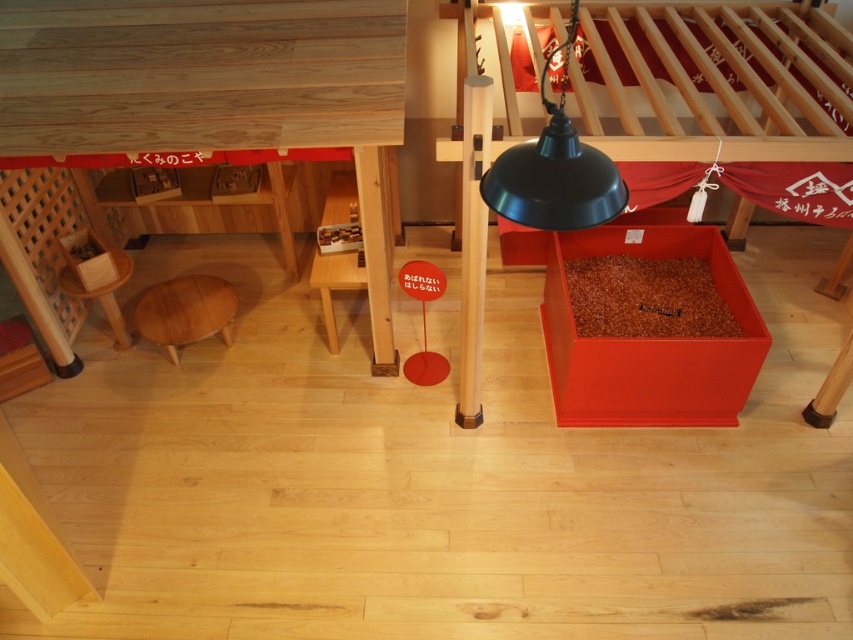
Between point (7, 81) and point (486, 202), which one is positioned behind?

The point (7, 81) is behind.

Is point (105, 104) farther from viewer compared to point (492, 172)?

Yes, point (105, 104) is farther from viewer.

Which is behind, point (96, 134) or point (524, 196)?

Positioned behind is point (96, 134).

Locate an element on the screen. The image size is (853, 640). wooden table at lower left is located at coordinates (213, 88).

Is point (271, 56) positioned in front of point (172, 323)?

Yes, it is.

Which is above, wooden table at lower left or light brown wooden stool at lower left?

wooden table at lower left

Locate an element on the screen. wooden table at lower left is located at coordinates (213, 88).

Find the location of a particular element. The height and width of the screenshot is (640, 853). wooden table at lower left is located at coordinates (213, 88).

This screenshot has height=640, width=853. What do you see at coordinates (555, 170) in the screenshot?
I see `black matte lamp at upper center` at bounding box center [555, 170].

Which is more to the left, black matte lamp at upper center or light brown wooden stool at lower left?

light brown wooden stool at lower left

Where is `black matte lamp at upper center`? The width and height of the screenshot is (853, 640). black matte lamp at upper center is located at coordinates (555, 170).